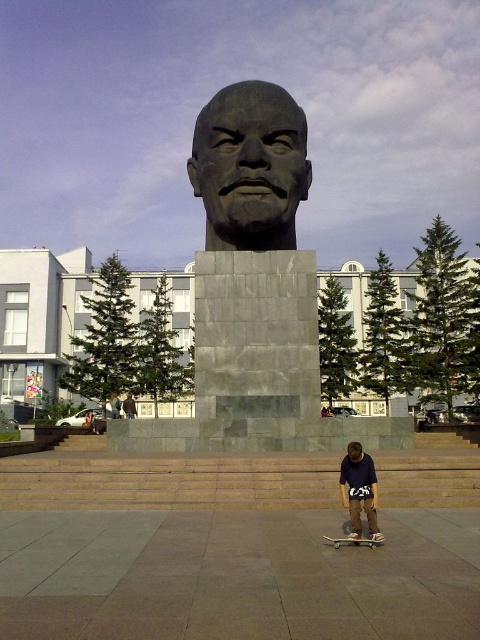
In the scene shown: What are the coordinates of the bronze statue at center in the image?

The bronze statue at center is located at coordinates [250,166].

You are a photographer planning to take a picture of the statue and the skateboarder. To ensure the wooden skateboard at lower center is centered in your shot, where should you position the camera relative to the statue?

The wooden skateboard at lower center is located at point (354, 541) in 2D coordinates, so positioning the camera to center on those coordinates will center the skateboard in the shot.

From the picture: You are standing at the base of the matte gray statue at center and want to place a new plaque on the wooden skateboard at lower center. Since the skateboard is closer, do you need to walk forward or backward to reach it?

The wooden skateboard at lower center is closer to the viewer than the matte gray statue at center. To place the plaque, you would need to walk backward away from the statue to reach the skateboard since it is nearer to your current position.